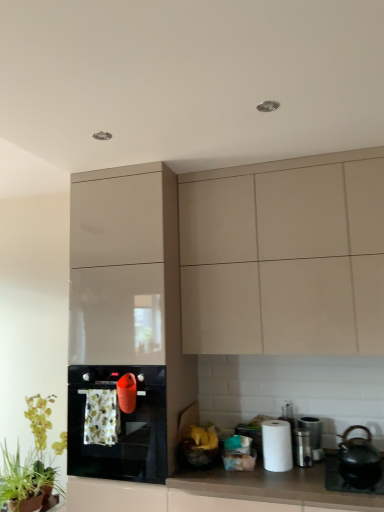
Question: From a real-world perspective, is glossy beige cabinet at center, marked as the 2th cabinetry in a right-to-left arrangement, physically located above or below matte beige cabinet at upper center, which is counted as the 1th cabinetry, starting from the right?

Choices:
 (A) above
 (B) below

Answer: (B)

Question: From the image's perspective, is glossy beige cabinet at center, which is the first cabinetry in left-to-right order, positioned above or below matte beige cabinet at upper center, which appears as the second cabinetry when viewed from the left?

Choices:
 (A) below
 (B) above

Answer: (A)

Question: Estimate the real-world distances between objects in this image. Which object is farther from the green leafy plant at lower left, which is the 2th plant in back-to-front order?

Choices:
 (A) green leafy plant at lower left, which is the 2th plant in front-to-back order
 (B) metallic silver trash can at lower right, marked as the 1th appliance in a front-to-back arrangement
 (C) black glossy oven at lower left
 (D) matte beige cabinet at upper center, which appears as the second cabinetry when viewed from the left
 (E) white paper at right

Answer: (D)

Question: Considering the real-world distances, which object is closest to the green leafy plant at lower left, marked as the first plant in a front-to-back arrangement?

Choices:
 (A) matte beige cabinet at upper center, which appears as the second cabinetry when viewed from the left
 (B) black glossy oven at lower left
 (C) green leafy plant at lower left, which is the first plant from back to front
 (D) black ceramic sink at lower right
 (E) satin silver canister at lower right, marked as the first appliance in a back-to-front arrangement

Answer: (C)